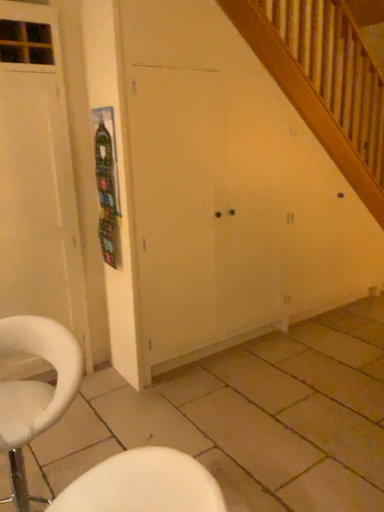
The width and height of the screenshot is (384, 512). Find the location of `free space above beige tile at lower center (from a real-world perspective)`. free space above beige tile at lower center (from a real-world perspective) is located at coordinates (271, 394).